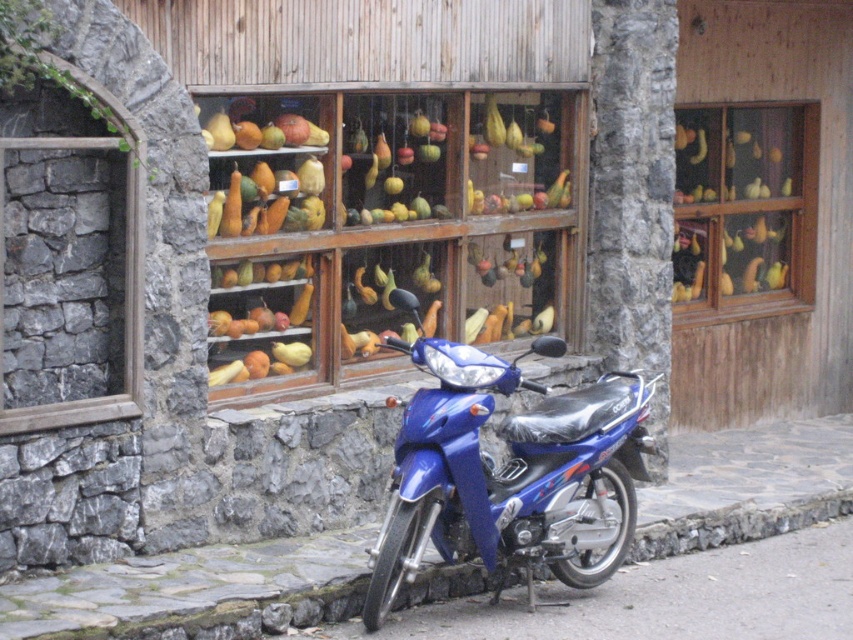
You are standing at the point marked as point [282,280] in front of a rustic stone storefront. You want to walk to the entrance of the store, which is 30 feet away from your current position. Is the entrance closer to you than the blue motor scooter parked in front of the store?

The distance between you and point [282,280] is 28.97 feet. Since the entrance is 30 feet away, the entrance is farther away than the blue motor scooter parked in front of the store. Therefore, the entrance is not closer than the blue motor scooter.